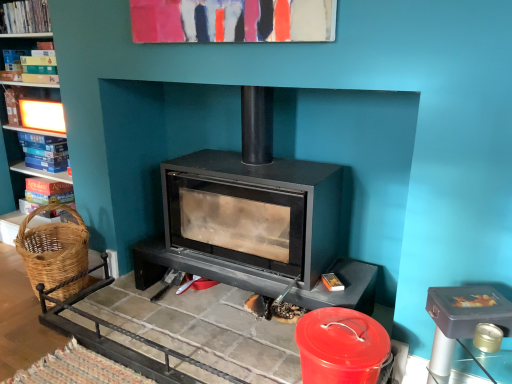
Question: Considering the relative sizes of matte cardboard book at left, placed as the 4th book when sorted from top to bottom, and hardcover book at left, placed as the third book when sorted from bottom to top, in the image provided, is matte cardboard book at left, placed as the 4th book when sorted from top to bottom, smaller than hardcover book at left, placed as the third book when sorted from bottom to top,?

Choices:
 (A) yes
 (B) no

Answer: (B)

Question: Can you confirm if matte cardboard book at left, placed as the 4th book when sorted from top to bottom, is positioned to the left of hardcover book at left, placed as the third book when sorted from bottom to top?

Choices:
 (A) no
 (B) yes

Answer: (A)

Question: Is matte cardboard book at left, placed as the 4th book when sorted from top to bottom, placed right next to hardcover book at left, placed as the third book when sorted from bottom to top?

Choices:
 (A) no
 (B) yes

Answer: (A)

Question: From the image's perspective, would you say matte cardboard book at left, arranged as the first book when ordered from the bottom, is shown under hardcover book at left, the 2th book viewed from the top?

Choices:
 (A) no
 (B) yes

Answer: (B)

Question: Considering the relative sizes of matte cardboard book at left, placed as the 4th book when sorted from top to bottom, and hardcover book at left, placed as the third book when sorted from bottom to top, in the image provided, is matte cardboard book at left, placed as the 4th book when sorted from top to bottom, wider than hardcover book at left, placed as the third book when sorted from bottom to top,?

Choices:
 (A) no
 (B) yes

Answer: (B)

Question: Choose the correct answer: Is blue cardboard book at left, which appears as the third book when viewed from the top, inside hardcover book at left, placed as the third book when sorted from bottom to top, or outside it?

Choices:
 (A) outside
 (B) inside

Answer: (A)

Question: Is blue cardboard book at left, which appears as the third book when viewed from the top, taller or shorter than hardcover book at left, the 2th book viewed from the top?

Choices:
 (A) tall
 (B) short

Answer: (A)

Question: Looking at their shapes, would you say blue cardboard book at left, which appears as the third book when viewed from the top, is wider or thinner than hardcover book at left, placed as the third book when sorted from bottom to top?

Choices:
 (A) wide
 (B) thin

Answer: (B)

Question: Visually, is blue cardboard book at left, the 2th book when ordered from bottom to top, positioned to the left or to the right of hardcover book at left, the 2th book viewed from the top?

Choices:
 (A) right
 (B) left

Answer: (A)

Question: Is blue cardboard book at left, which appears as the third book when viewed from the top, to the left or to the right of matte cardboard book at left, arranged as the first book when ordered from the bottom, in the image?

Choices:
 (A) left
 (B) right

Answer: (A)

Question: In terms of size, does blue cardboard book at left, which appears as the third book when viewed from the top, appear bigger or smaller than matte cardboard book at left, placed as the 4th book when sorted from top to bottom?

Choices:
 (A) small
 (B) big

Answer: (A)

Question: From the image's perspective, is blue cardboard book at left, which appears as the third book when viewed from the top, located above or below matte cardboard book at left, placed as the 4th book when sorted from top to bottom?

Choices:
 (A) below
 (B) above

Answer: (B)

Question: From a real-world perspective, relative to matte cardboard book at left, arranged as the first book when ordered from the bottom, is blue cardboard book at left, which appears as the third book when viewed from the top, vertically above or below?

Choices:
 (A) below
 (B) above

Answer: (B)

Question: Is matte cardboard book at left, arranged as the first book when ordered from the bottom, in front of or behind woven brown basket at left in the image?

Choices:
 (A) behind
 (B) front

Answer: (A)

Question: From a real-world perspective, is matte cardboard book at left, arranged as the first book when ordered from the bottom, positioned above or below woven brown basket at left?

Choices:
 (A) below
 (B) above

Answer: (B)